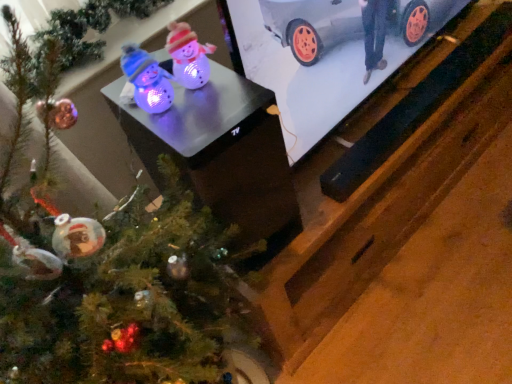
Question: Is green matte christmas tree at lower left directly adjacent to metallic silver car at upper right?

Choices:
 (A) yes
 (B) no

Answer: (B)

Question: Can you confirm if green matte christmas tree at lower left is taller than metallic silver car at upper right?

Choices:
 (A) yes
 (B) no

Answer: (A)

Question: Can you confirm if green matte christmas tree at lower left is smaller than metallic silver car at upper right?

Choices:
 (A) no
 (B) yes

Answer: (A)

Question: Is green matte christmas tree at lower left to the left of metallic silver car at upper right from the viewer's perspective?

Choices:
 (A) yes
 (B) no

Answer: (A)

Question: Is green matte christmas tree at lower left positioned before metallic silver car at upper right?

Choices:
 (A) no
 (B) yes

Answer: (B)

Question: Is the depth of green matte christmas tree at lower left greater than that of metallic silver car at upper right?

Choices:
 (A) no
 (B) yes

Answer: (A)

Question: Is metallic silver car at upper right with green matte christmas tree at lower left?

Choices:
 (A) no
 (B) yes

Answer: (A)

Question: Can you confirm if metallic silver car at upper right is bigger than green matte christmas tree at lower left?

Choices:
 (A) yes
 (B) no

Answer: (B)

Question: Is metallic silver car at upper right thinner than green matte christmas tree at lower left?

Choices:
 (A) yes
 (B) no

Answer: (A)

Question: Is metallic silver car at upper right turned away from green matte christmas tree at lower left?

Choices:
 (A) no
 (B) yes

Answer: (A)

Question: From a real-world perspective, is metallic silver car at upper right beneath green matte christmas tree at lower left?

Choices:
 (A) no
 (B) yes

Answer: (A)

Question: Considering the relative sizes of metallic silver car at upper right and green matte christmas tree at lower left in the image provided, is metallic silver car at upper right taller than green matte christmas tree at lower left?

Choices:
 (A) yes
 (B) no

Answer: (B)

Question: Is matte plastic table at center positioned with its back to green matte christmas tree at lower left?

Choices:
 (A) no
 (B) yes

Answer: (A)